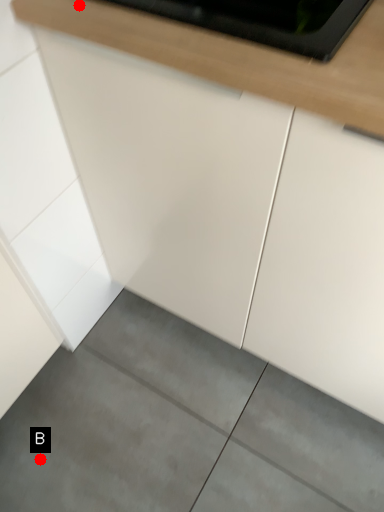
Question: Two points are circled on the image, labeled by A and B beside each circle. Which point is closer to the camera?

Choices:
 (A) A is closer
 (B) B is closer

Answer: (A)